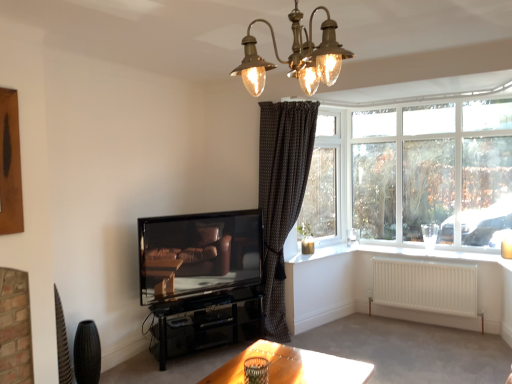
This screenshot has width=512, height=384. I want to click on empty space that is ontop of white matte radiator at lower right (from a real-world perspective), so click(438, 265).